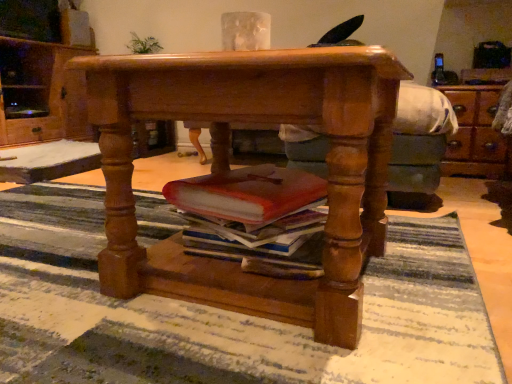
Question: Should I look upward or downward to see green leafy plant at upper left?

Choices:
 (A) up
 (B) down

Answer: (A)

Question: Is polished wood desk at center oriented away from striped rug at center?

Choices:
 (A) yes
 (B) no

Answer: (B)

Question: Is polished wood desk at center further to the viewer compared to striped rug at center?

Choices:
 (A) yes
 (B) no

Answer: (A)

Question: From a real-world perspective, is polished wood desk at center positioned over striped rug at center based on gravity?

Choices:
 (A) yes
 (B) no

Answer: (A)

Question: Does polished wood desk at center have a lesser width compared to striped rug at center?

Choices:
 (A) no
 (B) yes

Answer: (B)

Question: Is polished wood desk at center completely or partially outside of striped rug at center?

Choices:
 (A) no
 (B) yes

Answer: (B)

Question: From a real-world perspective, is polished wood desk at center physically below striped rug at center?

Choices:
 (A) no
 (B) yes

Answer: (A)

Question: Does striped rug at center have a greater width compared to green leafy plant at upper left?

Choices:
 (A) yes
 (B) no

Answer: (A)

Question: Is striped rug at center positioned in front of green leafy plant at upper left?

Choices:
 (A) yes
 (B) no

Answer: (A)

Question: Can you confirm if striped rug at center is shorter than green leafy plant at upper left?

Choices:
 (A) yes
 (B) no

Answer: (A)

Question: Is striped rug at center next to green leafy plant at upper left and touching it?

Choices:
 (A) yes
 (B) no

Answer: (B)

Question: From the image's perspective, is striped rug at center under green leafy plant at upper left?

Choices:
 (A) no
 (B) yes

Answer: (B)

Question: Does striped rug at center lie behind green leafy plant at upper left?

Choices:
 (A) no
 (B) yes

Answer: (A)

Question: Is green leafy plant at upper left thinner than polished wood desk at center?

Choices:
 (A) yes
 (B) no

Answer: (A)